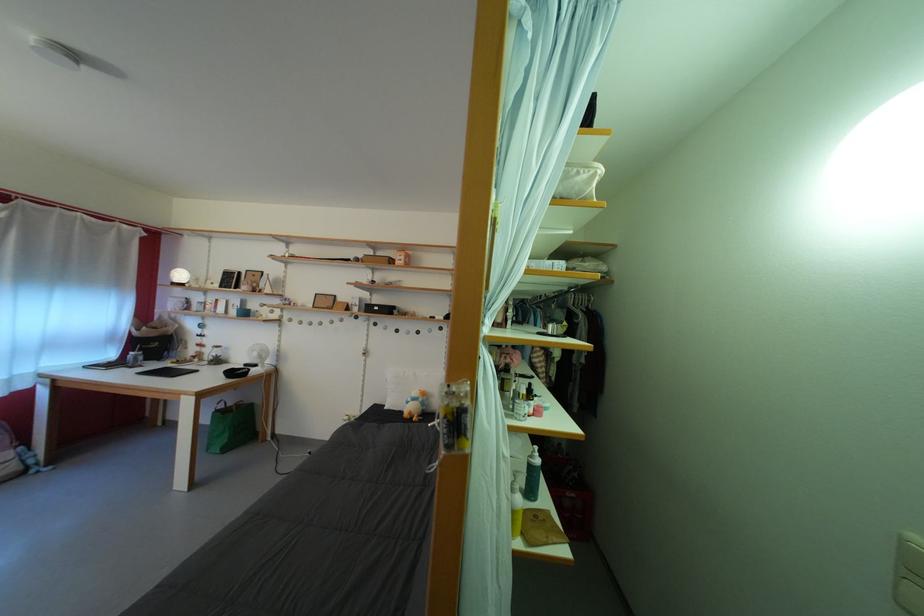
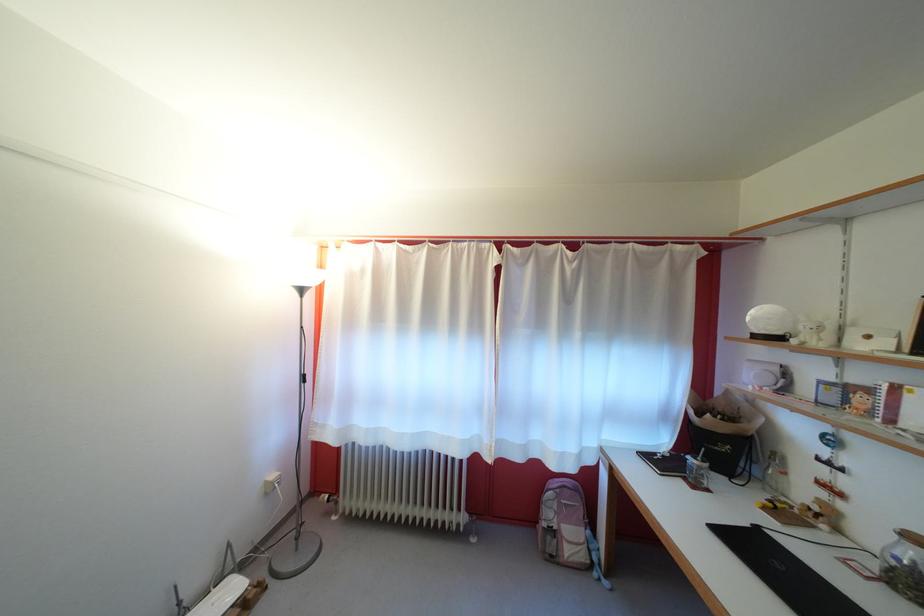
Find the pixel in the second image that matches [144,362] in the first image.

(708, 474)